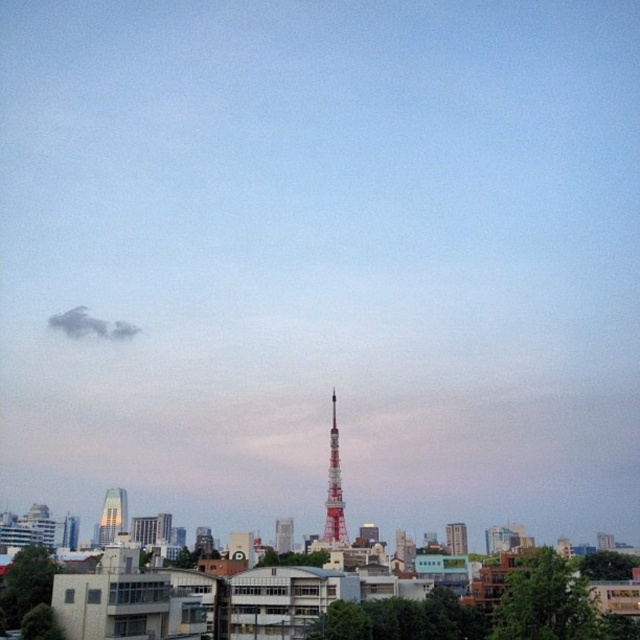
Is red painted metal tower at center positioned at the back of silver glass skyscraper at lower left?

No, it is not.

Find the location of `red painted metal tower at center`. red painted metal tower at center is located at coordinates 333,490.

Is red painted metal tower at center below white glossy tower at center?

No.

Is red painted metal tower at center positioned at the back of white glossy tower at center?

No, red painted metal tower at center is closer to the viewer.

At what (x,y) coordinates should I click in order to perform the action: click on red painted metal tower at center. Please return your answer as a coordinate pair (x, y). Image resolution: width=640 pixels, height=640 pixels. Looking at the image, I should click on pyautogui.click(x=333, y=490).

In order to click on red painted metal tower at center in this screenshot , I will do `click(333, 490)`.

Who is positioned more to the right, gray cotton cloud at upper left or red metallic tower at center?

red metallic tower at center

The width and height of the screenshot is (640, 640). What do you see at coordinates (90, 324) in the screenshot?
I see `gray cotton cloud at upper left` at bounding box center [90, 324].

Which is in front, point (61, 332) or point (456, 531)?

Point (456, 531)

I want to click on gray cotton cloud at upper left, so click(x=90, y=324).